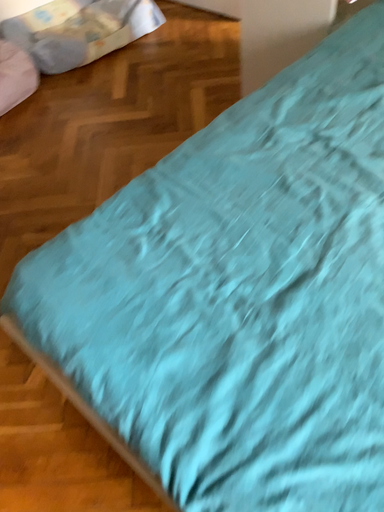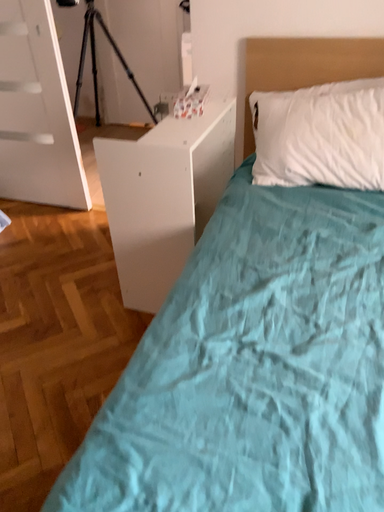
Question: Which way did the camera rotate in the video?

Choices:
 (A) rotated downward
 (B) rotated upward

Answer: (B)